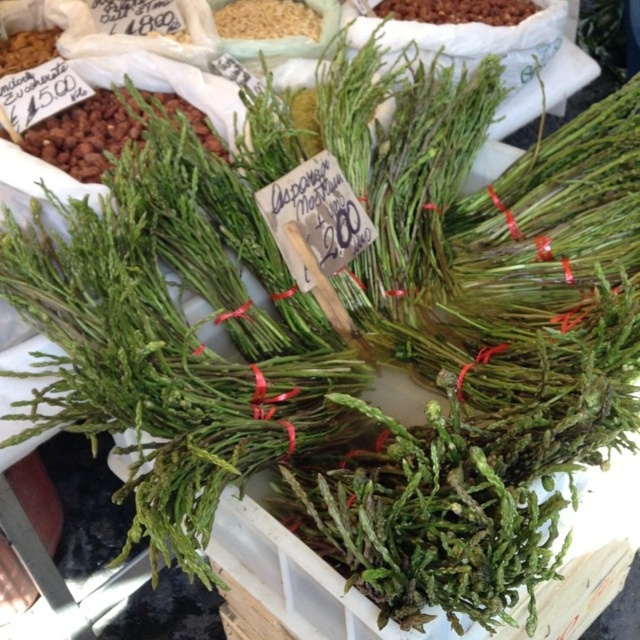
Looking at this image, is green leafy vegetable at upper left below brown grain at upper center?

Yes, green leafy vegetable at upper left is below brown grain at upper center.

I want to click on green leafy vegetable at upper left, so 86,134.

Is point (116, 102) positioned in front of point (273, 32)?

That is True.

Locate an element on the screen. This screenshot has height=640, width=640. green leafy vegetable at upper left is located at coordinates (86, 134).

Who is shorter, green leafy vegetable at upper left or brown crunchy nuts at upper center?

Standing shorter between the two is brown crunchy nuts at upper center.

Can you confirm if green leafy vegetable at upper left is wider than brown crunchy nuts at upper center?

Yes.

Locate an element on the screen. green leafy vegetable at upper left is located at coordinates (86, 134).

Can you confirm if brown grain at upper center is shorter than brown crunchy nuts at upper center?

Incorrect, brown grain at upper center's height does not fall short of brown crunchy nuts at upper center's.

Who is positioned more to the left, brown grain at upper center or brown crunchy nuts at upper center?

brown grain at upper center is more to the left.

Is point (308, 17) positioned behind point (404, 6)?

No, (308, 17) is closer to viewer.

Where is `brown grain at upper center`? brown grain at upper center is located at coordinates (266, 19).